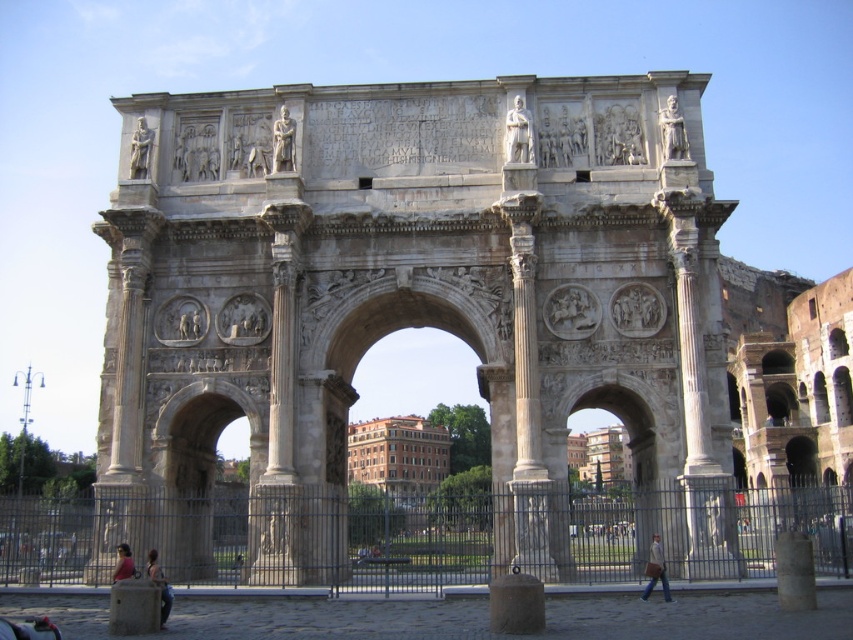
Which of these two, polished marble statue at upper left or light brown leather jacket at lower center, stands shorter?

polished marble statue at upper left is shorter.

Who is positioned more to the right, polished marble statue at upper left or light brown leather jacket at lower center?

From the viewer's perspective, light brown leather jacket at lower center appears more on the right side.

What do you see at coordinates (140, 150) in the screenshot?
I see `polished marble statue at upper left` at bounding box center [140, 150].

Find the location of a particular element. This screenshot has height=640, width=853. polished marble statue at upper left is located at coordinates (140, 150).

Is white marble statue at upper right to the left of dark blue jeans at lower center from the viewer's perspective?

No, white marble statue at upper right is not to the left of dark blue jeans at lower center.

Can you confirm if white marble statue at upper right is positioned below dark blue jeans at lower center?

No.

Does point (675, 150) come closer to viewer compared to point (169, 602)?

That is False.

Identify the location of white marble statue at upper right. (672, 131).

In the scene shown: Between white marble statue at upper center and light brown leather jacket at lower center, which one is positioned lower?

Positioned lower is light brown leather jacket at lower center.

Where is `white marble statue at upper center`? The height and width of the screenshot is (640, 853). white marble statue at upper center is located at coordinates point(518,132).

Find the location of a particular element. white marble statue at upper center is located at coordinates (518, 132).